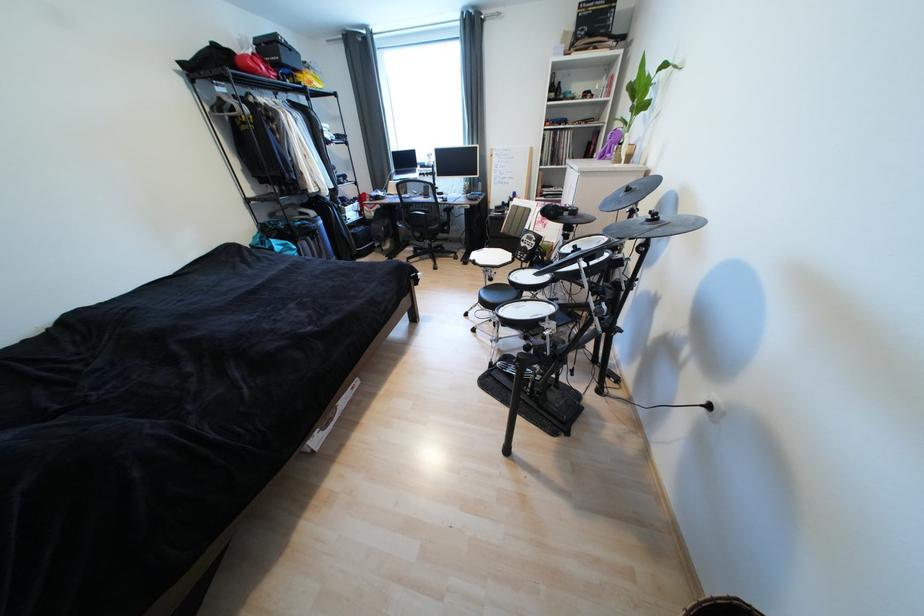
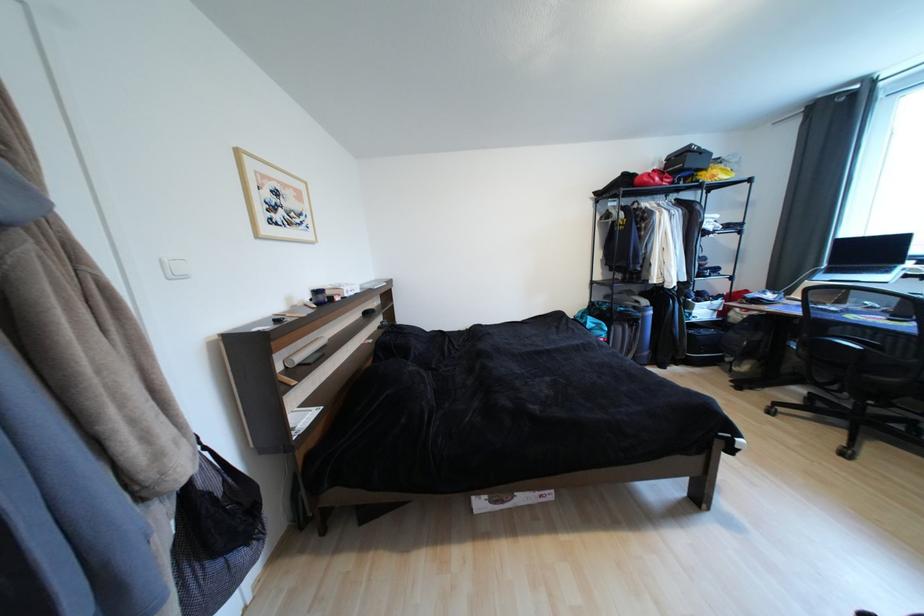
Question: The first image is from the beginning of the video and the second image is from the end. How did the camera likely rotate when shooting the video?

Choices:
 (A) Left
 (B) Right
 (C) Up
 (D) Down

Answer: (A)